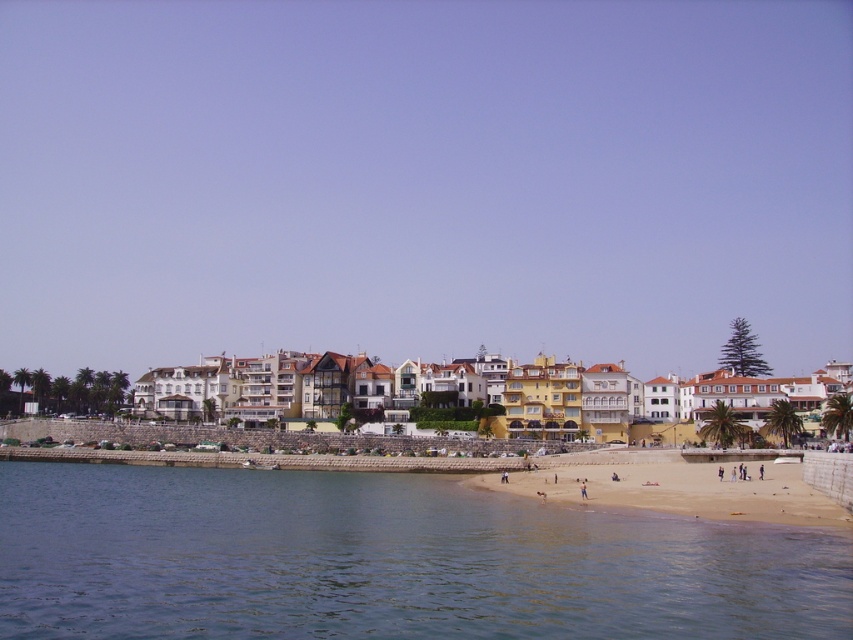
You are standing at the point with coordinates [387,561] on the beach. What can you see directly in front of you?

You can see clear blue water at lower left directly in front of you at the point with coordinates [387,561].

You are standing at the origin point of the coordinate system in this coastal scene. You want to walk towards the clear blue water at lower left. What are the coordinates you need to move towards?

You need to move towards the coordinates point at 0.877 on the x axis and 0.455 on the y axis where the clear blue water at lower left is located.

You are a photographer planning to capture the beach scene. You want to focus on the clear blue water at lower left and the light brown sand at lower center. Which area occupies more space in the image?

The clear blue water at lower left is bigger than the light brown sand at lower center, so the clear blue water at lower left occupies more space in the image.